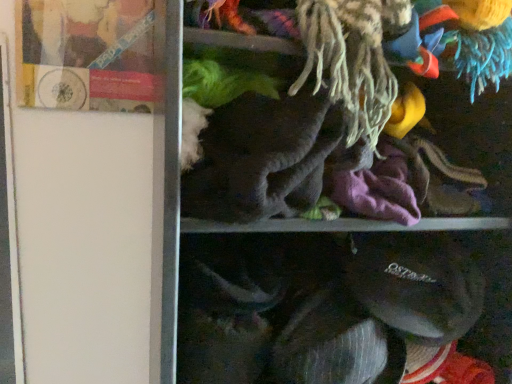
Question: Does matte plastic book at upper left have a lesser height compared to soft gray fabric at center?

Choices:
 (A) no
 (B) yes

Answer: (A)

Question: From a real-world perspective, is matte plastic book at upper left under soft gray fabric at center?

Choices:
 (A) no
 (B) yes

Answer: (A)

Question: Is matte plastic book at upper left looking in the opposite direction of soft gray fabric at center?

Choices:
 (A) yes
 (B) no

Answer: (B)

Question: Is matte plastic book at upper left far away from soft gray fabric at center?

Choices:
 (A) yes
 (B) no

Answer: (B)

Question: Can you confirm if matte plastic book at upper left is bigger than soft gray fabric at center?

Choices:
 (A) no
 (B) yes

Answer: (A)

Question: Is matte plastic book at upper left to the left of soft gray fabric at center from the viewer's perspective?

Choices:
 (A) yes
 (B) no

Answer: (A)

Question: Is soft gray fabric at center facing towards matte plastic book at upper left?

Choices:
 (A) no
 (B) yes

Answer: (A)

Question: Is soft gray fabric at center smaller than matte plastic book at upper left?

Choices:
 (A) no
 (B) yes

Answer: (A)

Question: Are soft gray fabric at center and matte plastic book at upper left located far from each other?

Choices:
 (A) yes
 (B) no

Answer: (B)

Question: Is soft gray fabric at center located outside matte plastic book at upper left?

Choices:
 (A) no
 (B) yes

Answer: (B)

Question: Considering the relative sizes of soft gray fabric at center and matte plastic book at upper left in the image provided, is soft gray fabric at center taller than matte plastic book at upper left?

Choices:
 (A) yes
 (B) no

Answer: (B)

Question: Is soft gray fabric at center to the right of matte plastic book at upper left from the viewer's perspective?

Choices:
 (A) no
 (B) yes

Answer: (B)

Question: Does point (380, 74) appear closer or farther from the camera than point (138, 87)?

Choices:
 (A) closer
 (B) farther

Answer: (A)